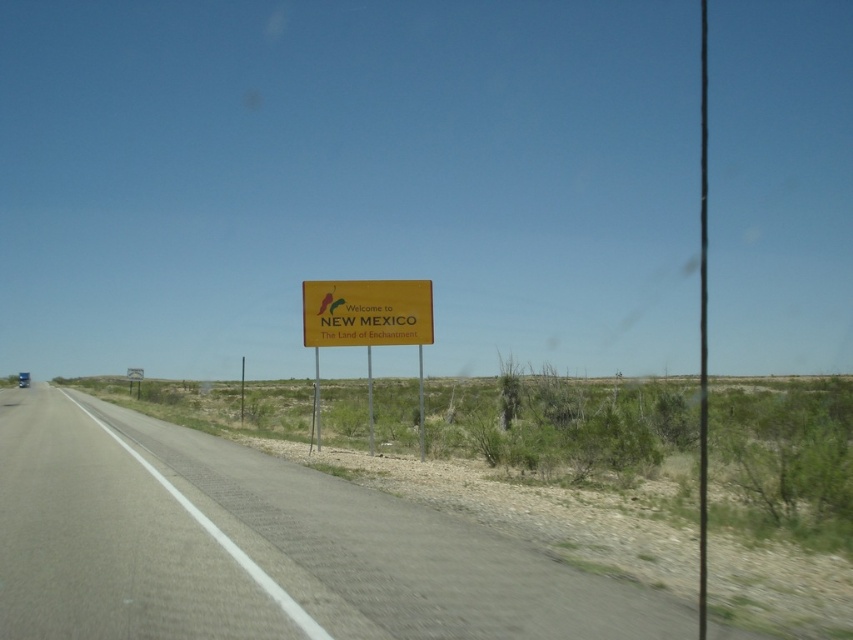
Can you confirm if gray asphalt road at center is positioned to the right of yellow matte sign at center?

Incorrect, gray asphalt road at center is not on the right side of yellow matte sign at center.

Can you confirm if gray asphalt road at center is positioned above yellow matte sign at center?

No.

Where is `gray asphalt road at center`? Image resolution: width=853 pixels, height=640 pixels. gray asphalt road at center is located at coordinates (259, 547).